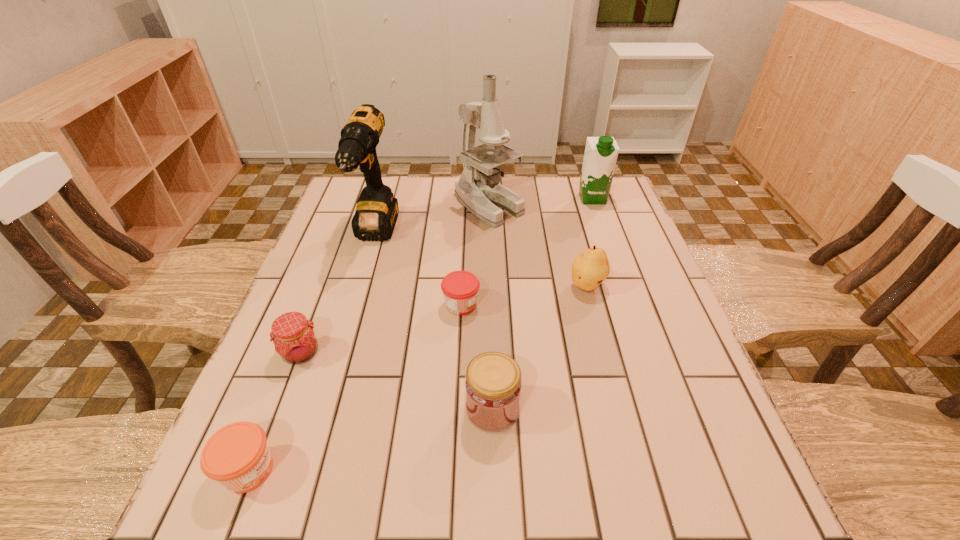
Find the location of a particular element. microscope is located at coordinates 478,189.

In order to click on the second tallest object in this screenshot , I will do (x=376, y=213).

Find the location of a particular element. This screenshot has width=960, height=540. soya milk is located at coordinates (601, 153).

The image size is (960, 540). In order to click on pear in this screenshot , I will do `click(589, 269)`.

The height and width of the screenshot is (540, 960). Identify the location of the third farthest jam. 493,385.

Where is `the seventh farthest object`? The height and width of the screenshot is (540, 960). the seventh farthest object is located at coordinates (493, 385).

Where is `the third nearest object`? the third nearest object is located at coordinates (295, 341).

I want to click on the nearest jam, so click(x=237, y=456).

Where is `the farthest jam`? Image resolution: width=960 pixels, height=540 pixels. the farthest jam is located at coordinates (460, 288).

Where is `free region located 0.330m on the front of the microscope`? Image resolution: width=960 pixels, height=540 pixels. free region located 0.330m on the front of the microscope is located at coordinates (492, 310).